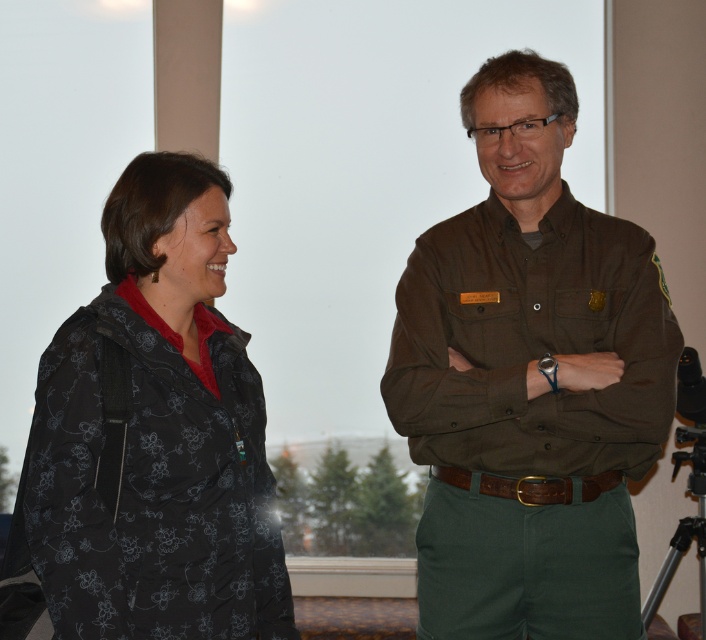
Question: Does black floral-patterned jacket at left appear over black metal tripod at lower right?

Choices:
 (A) no
 (B) yes

Answer: (B)

Question: Can you confirm if brown uniform at right is positioned to the right of brown leather belt at center?

Choices:
 (A) yes
 (B) no

Answer: (A)

Question: Which point is farther to the camera?

Choices:
 (A) black metal tripod at lower right
 (B) black floral-patterned jacket at left

Answer: (A)

Question: Is black floral-patterned jacket at left to the left of brown leather belt at center from the viewer's perspective?

Choices:
 (A) yes
 (B) no

Answer: (A)

Question: Which point appears closest to the camera in this image?

Choices:
 (A) (652, 589)
 (B) (467, 627)
 (C) (556, 490)

Answer: (C)

Question: Which object is positioned closest to the brown uniform at right?

Choices:
 (A) black floral-patterned jacket at left
 (B) brown leather belt at center
 (C) black metal tripod at lower right

Answer: (B)